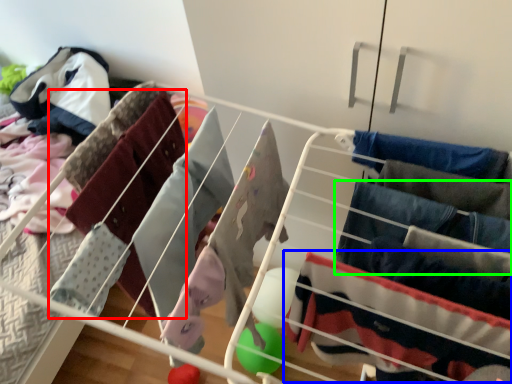
Question: Estimate the real-world distances between objects in this image. Which object is closer to clothing (highlighted by a red box), clothing (highlighted by a blue box) or clothing (highlighted by a green box)?

Choices:
 (A) clothing
 (B) clothing

Answer: (A)